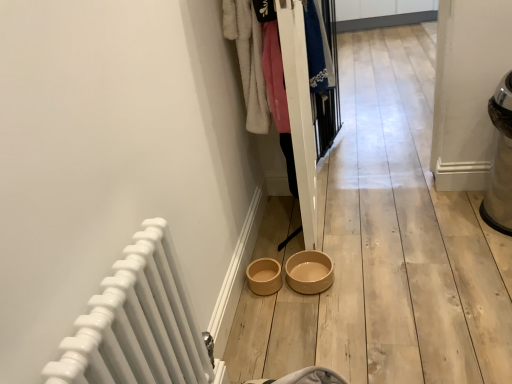
The image size is (512, 384). What do you see at coordinates (248, 60) in the screenshot? I see `white fluffy coat at upper center, acting as the 2th clothing starting from the right` at bounding box center [248, 60].

How much space does white fluffy coat at upper center, acting as the 2th clothing starting from the right, occupy vertically?

white fluffy coat at upper center, acting as the 2th clothing starting from the right, is 24.12 inches tall.

The image size is (512, 384). What do you see at coordinates (309, 272) in the screenshot?
I see `beige ceramic bowl at center` at bounding box center [309, 272].

The height and width of the screenshot is (384, 512). In order to click on white wooden closet at center in this screenshot , I will do `click(300, 105)`.

Considering the positions of point (149, 340) and point (292, 119), is point (149, 340) closer or farther from the camera than point (292, 119)?

Point (149, 340) appears to be closer to the viewer than point (292, 119).

From a real-world perspective, between white glossy radiator at lower left and white wooden closet at center, who is vertically lower?

white glossy radiator at lower left.

Consider the image. Who is taller, white glossy radiator at lower left or white wooden closet at center?

With more height is white wooden closet at center.

From a real-world perspective, is white wooden closet at center physically located above or below beige ceramic bowl at center?

From a real-world perspective, white wooden closet at center is physically above beige ceramic bowl at center.

From the image's perspective, is white wooden closet at center located above beige ceramic bowl at center?

Yes, from the image's perspective, white wooden closet at center is above beige ceramic bowl at center.

Is white wooden closet at center not close to beige ceramic bowl at center?

No.

Is point (241, 59) behind point (329, 280)?

No.

From a real-world perspective, who is located higher, white fluffy coat at upper center, acting as the 2th clothing starting from the right, or white glossy radiator at lower left?

From a 3D spatial view, white fluffy coat at upper center, acting as the 2th clothing starting from the right, is above.

Does point (268, 126) lie behind point (182, 363)?

Yes.

This screenshot has width=512, height=384. I want to click on radiator below the white fluffy coat at upper center, which ranks as the second clothing in back-to-front order (from a real-world perspective), so click(x=138, y=323).

Could you tell me if white fluffy coat at upper center, acting as the 2th clothing starting from the right, is facing white glossy radiator at lower left?

Yes, white fluffy coat at upper center, acting as the 2th clothing starting from the right, is aimed at white glossy radiator at lower left.

From the image's perspective, does blue cotton shirt at center, which is the 1th clothing in back-to-front order, appear higher than white fluffy coat at upper center, the first clothing positioned from the front?

Yes.

Between blue cotton shirt at center, which ranks as the first clothing in right-to-left order, and white fluffy coat at upper center, which ranks as the second clothing in back-to-front order, which one is positioned behind?

blue cotton shirt at center, which ranks as the first clothing in right-to-left order, is behind.

Does blue cotton shirt at center, arranged as the second clothing when viewed from the front, have a greater width compared to white fluffy coat at upper center, which ranks as the second clothing in back-to-front order?

No.

Where is `clothing lying on the right of white fluffy coat at upper center, which ranks as the second clothing in back-to-front order`? clothing lying on the right of white fluffy coat at upper center, which ranks as the second clothing in back-to-front order is located at coordinates (317, 49).

What's the angular difference between white glossy radiator at lower left and beige ceramic bowl at center's facing directions?

0.0513 degrees.

From the image's perspective, relative to beige ceramic bowl at center, is white glossy radiator at lower left above or below?

Based on their image positions, white glossy radiator at lower left is located beneath beige ceramic bowl at center.

Is beige ceramic bowl at center located within white glossy radiator at lower left?

No, beige ceramic bowl at center is not a part of white glossy radiator at lower left.

Is white glossy radiator at lower left bigger or smaller than beige ceramic bowl at center?

Considering their sizes, white glossy radiator at lower left takes up more space than beige ceramic bowl at center.

From a real-world perspective, is white wooden closet at center on white fluffy coat at upper center, the first clothing positioned from the front?

No, from a real-world perspective, white wooden closet at center is not above white fluffy coat at upper center, the first clothing positioned from the front.

Looking at this image, visually, is white wooden closet at center positioned to the left or to the right of white fluffy coat at upper center, the first clothing positioned from the front?

white wooden closet at center is to the right of white fluffy coat at upper center, the first clothing positioned from the front.

Is white wooden closet at center taller than white fluffy coat at upper center, which ranks as the second clothing in back-to-front order?

Yes, white wooden closet at center is taller than white fluffy coat at upper center, which ranks as the second clothing in back-to-front order.

Is blue cotton shirt at center, which ranks as the first clothing in right-to-left order, at the right side of white wooden closet at center?

Indeed, blue cotton shirt at center, which ranks as the first clothing in right-to-left order, is positioned on the right side of white wooden closet at center.

From a real-world perspective, between blue cotton shirt at center, which ranks as the first clothing in right-to-left order, and white wooden closet at center, who is vertically higher?

In real-world perspective, blue cotton shirt at center, which ranks as the first clothing in right-to-left order, is above.

This screenshot has width=512, height=384. I want to click on closet in front of the blue cotton shirt at center, which is the 1th clothing in back-to-front order, so click(x=300, y=105).

This screenshot has height=384, width=512. In order to click on radiator lying on the left of white wooden closet at center in this screenshot , I will do `click(138, 323)`.

Locate an element on the screen. Image resolution: width=512 pixels, height=384 pixels. closet in front of the beige ceramic bowl at center is located at coordinates (300, 105).

When comparing their distances from white wooden closet at center, does white glossy radiator at lower left or blue cotton shirt at center, arranged as the second clothing when viewed from the front, seem closer?

Based on the image, blue cotton shirt at center, arranged as the second clothing when viewed from the front, appears to be nearer to white wooden closet at center.

Based on their spatial positions, is white wooden closet at center or white glossy radiator at lower left further from beige ceramic bowl at center?

Based on the image, white glossy radiator at lower left appears to be further to beige ceramic bowl at center.

When comparing their distances from white fluffy coat at upper center, which ranks as the second clothing in back-to-front order, does blue cotton shirt at center, which ranks as the first clothing in right-to-left order, or white wooden closet at center seem further?

blue cotton shirt at center, which ranks as the first clothing in right-to-left order.

When comparing their distances from white glossy radiator at lower left, does white wooden closet at center or white fluffy coat at upper center, the first clothing positioned from the front, seem closer?

white wooden closet at center lies closer to white glossy radiator at lower left than the other object.

Estimate the real-world distances between objects in this image. Which object is further from white glossy radiator at lower left, blue cotton shirt at center, which ranks as the first clothing in right-to-left order, or beige ceramic bowl at center?

blue cotton shirt at center, which ranks as the first clothing in right-to-left order.

Which object lies further to the anchor point blue cotton shirt at center, which is the 1th clothing in back-to-front order, white glossy radiator at lower left or beige ceramic bowl at center?

white glossy radiator at lower left is further to blue cotton shirt at center, which is the 1th clothing in back-to-front order.

Estimate the real-world distances between objects in this image. Which object is closer to white glossy radiator at lower left, white wooden closet at center or blue cotton shirt at center, the 2th clothing positioned from the left?

white wooden closet at center.

Which object lies further to the anchor point beige ceramic bowl at center, blue cotton shirt at center, arranged as the second clothing when viewed from the front, or white wooden closet at center?

Among the two, blue cotton shirt at center, arranged as the second clothing when viewed from the front, is located further to beige ceramic bowl at center.

Where is `closet between white glossy radiator at lower left and blue cotton shirt at center, arranged as the second clothing when viewed from the front, in the front-back direction`? Image resolution: width=512 pixels, height=384 pixels. closet between white glossy radiator at lower left and blue cotton shirt at center, arranged as the second clothing when viewed from the front, in the front-back direction is located at coordinates (300, 105).

This screenshot has width=512, height=384. In order to click on closet between white fluffy coat at upper center, acting as the 2th clothing starting from the right, and beige ceramic bowl at center in the up-down direction in this screenshot , I will do (300, 105).

Image resolution: width=512 pixels, height=384 pixels. Find the location of `clothing between white glossy radiator at lower left and blue cotton shirt at center, the 2th clothing positioned from the left, from front to back`. clothing between white glossy radiator at lower left and blue cotton shirt at center, the 2th clothing positioned from the left, from front to back is located at coordinates (248, 60).

You are a GUI agent. You are given a task and a screenshot of the screen. Output one action in this format:
    pyautogui.click(x=<x>, y=<y>)
    Task: Click on the closet between white glossy radiator at lower left and beige ceramic bowl at center in the front-back direction
    
    Given the screenshot: What is the action you would take?
    pyautogui.click(x=300, y=105)